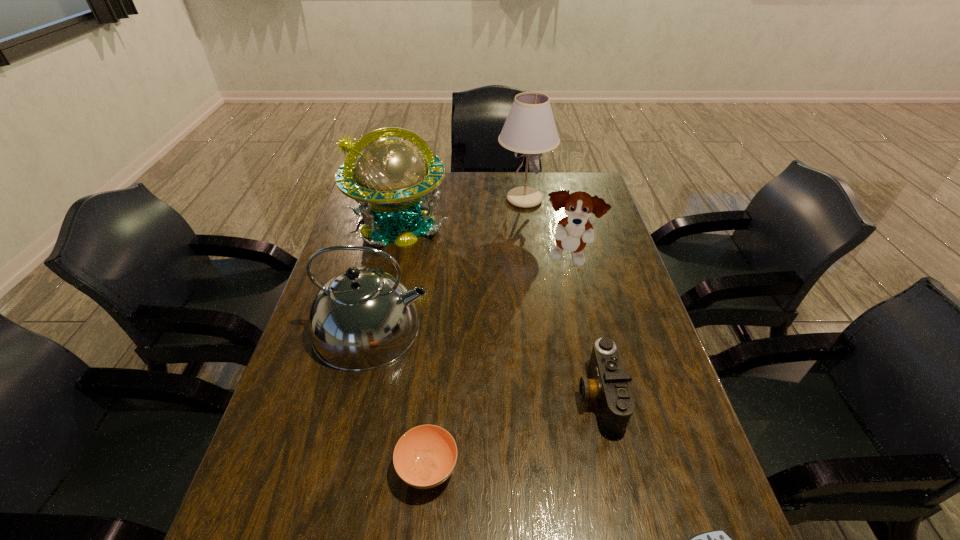
Find the location of a particular element. camera located at the right edge is located at coordinates (608, 386).

I want to click on object at the far left corner, so click(391, 179).

The width and height of the screenshot is (960, 540). In order to click on free location at the far edge in this screenshot , I will do `click(468, 202)`.

Where is `free space at the left edge`? The height and width of the screenshot is (540, 960). free space at the left edge is located at coordinates pos(300,375).

Where is `free space at the right edge`? This screenshot has width=960, height=540. free space at the right edge is located at coordinates (609, 289).

The height and width of the screenshot is (540, 960). Identify the location of free point between the puppy and the lampshade. (546, 229).

Locate an element on the screen. free spot between the globe and the second nearest object is located at coordinates (413, 347).

Find the location of `empty space that is in between the puppy and the globe`. empty space that is in between the puppy and the globe is located at coordinates (483, 241).

Where is `free spot between the camera and the kettle`? free spot between the camera and the kettle is located at coordinates (486, 362).

I want to click on free space between the kettle and the second shortest object, so click(399, 399).